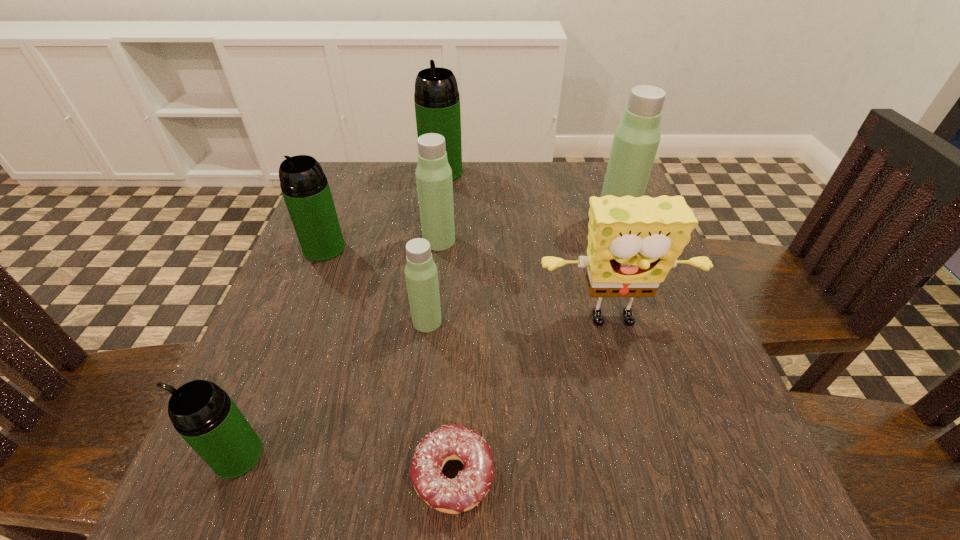
The height and width of the screenshot is (540, 960). Find the location of `thermos bottle located at the near edge`. thermos bottle located at the near edge is located at coordinates (x=205, y=416).

You are a GUI agent. You are given a task and a screenshot of the screen. Output one action in this format:
    pyautogui.click(x=<x>, y=<y>)
    Task: Click on the doughnut positioned at the near edge
    The image size is (960, 540).
    Given the screenshot: What is the action you would take?
    pyautogui.click(x=451, y=441)

Where is `thermos bottle that is at the right edge`? The height and width of the screenshot is (540, 960). thermos bottle that is at the right edge is located at coordinates (637, 137).

Find the location of `sponge that is at the right edge`. sponge that is at the right edge is located at coordinates point(633,242).

Image resolution: width=960 pixels, height=540 pixels. Identify the location of object located in the near left corner section of the desktop. (205, 416).

I want to click on object that is at the far right corner, so click(x=637, y=137).

This screenshot has width=960, height=540. Identify the location of free region at the far edge of the desktop. point(571,213).

Locate an element on the screen. The width and height of the screenshot is (960, 540). free location at the left edge of the desktop is located at coordinates (329, 290).

This screenshot has height=540, width=960. What are the coordinates of `vacant space at the right edge` in the screenshot? It's located at (739, 423).

Where is `free space at the far left corner`? free space at the far left corner is located at coordinates (336, 170).